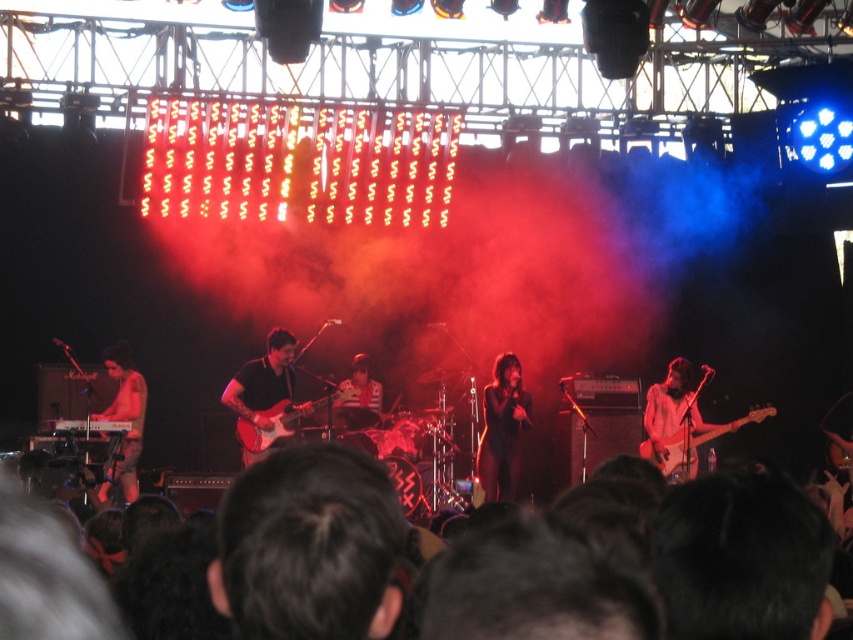
You are a photographer trying to capture the best shot of the stage. You notice the glossy wood guitar at center and the striped fabric drum set at center. Which object should you focus on first if you want to highlight the one that is nearer to the camera?

The glossy wood guitar at center is closer to the viewer than the striped fabric drum set at center, so you should focus on the glossy wood guitar at center first to highlight the nearer object.

You are a stagehand who needs to adjust the lighting above the glossy wood guitar at center and the striped fabric drum set at center. Which object is located lower in the scene?

The glossy wood guitar at center is positioned under the striped fabric drum set at center, so it is lower in the scene.

You are a photographer at the concert. You want to capture a photo that includes both the dark hair at lower center and the striped fabric drum set at center. Based on their widths, which object should you adjust your camera angle to focus on first to ensure both fit in the frame?

dark hair at lower center might be wider than striped fabric drum set at center, so you should focus on dark hair at lower center first to ensure both fit in the frame.